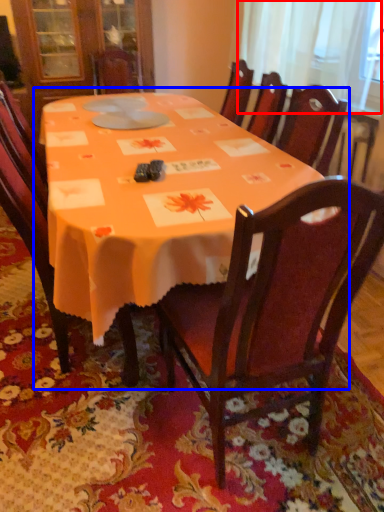
Question: Which point is further to the camera, curtain (highlighted by a red box) or table (highlighted by a blue box)?

Choices:
 (A) curtain
 (B) table

Answer: (A)